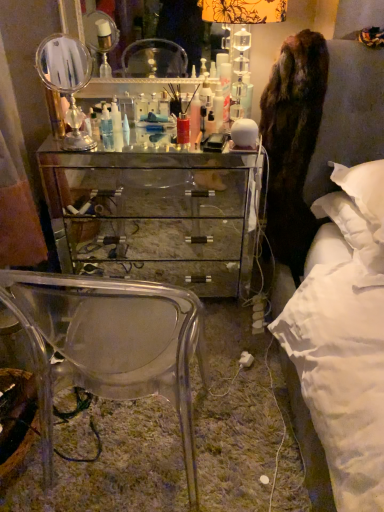
Locate an element on the screen. This screenshot has height=512, width=384. vacant point to the right of clear plastic bottle at center, arranged as the 2th toiletry when viewed from the right is located at coordinates (149, 134).